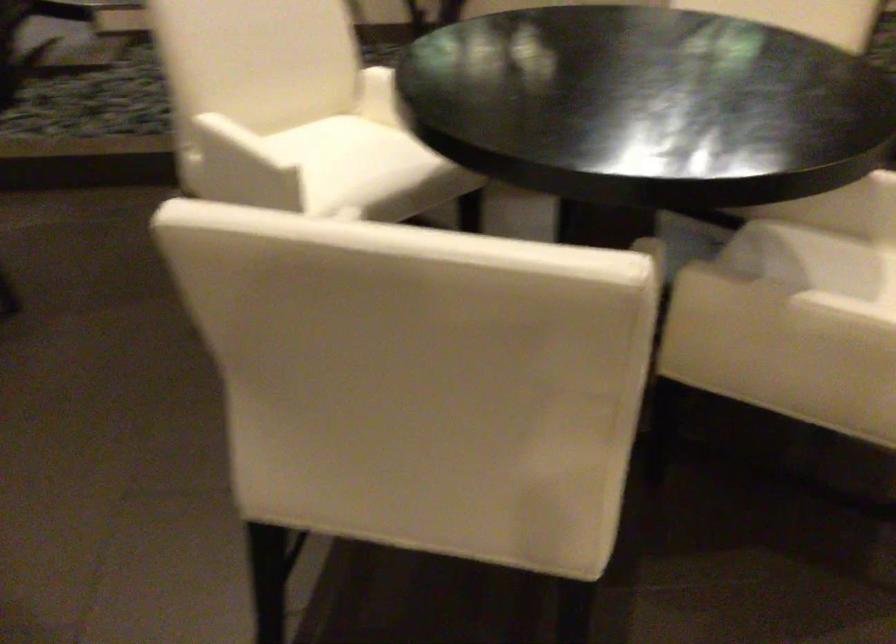
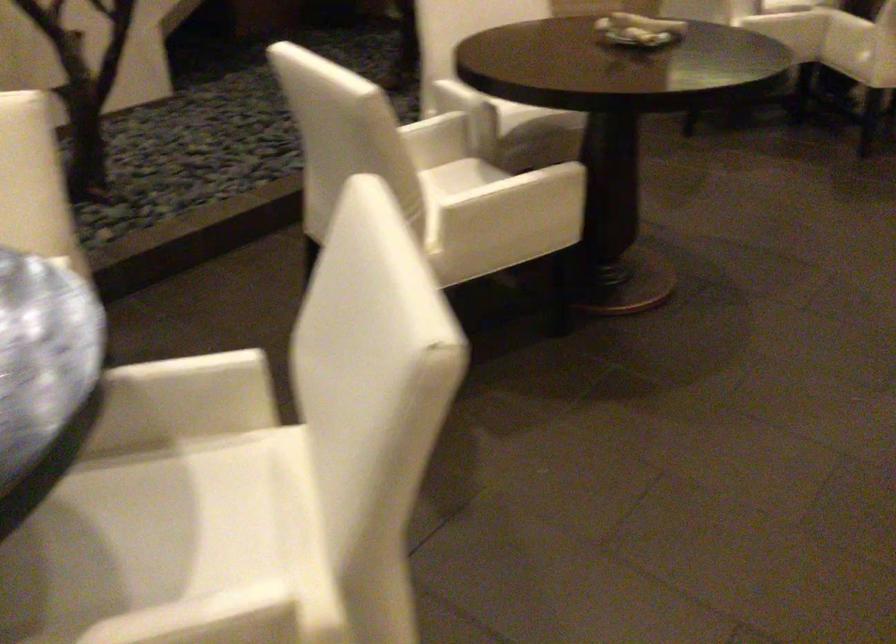
Question: The first image is from the beginning of the video and the second image is from the end. How did the camera likely rotate when shooting the video?

Choices:
 (A) Left
 (B) Right
 (C) Up
 (D) Down

Answer: (B)